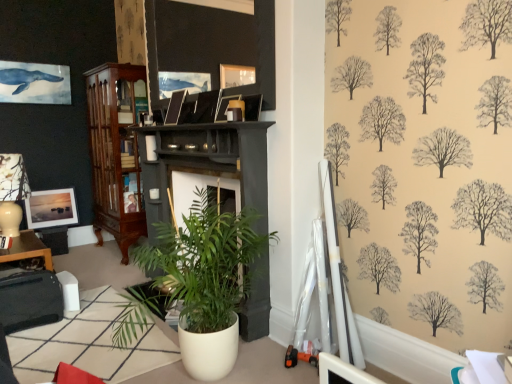
Question: In terms of height, does wooden picture frame at upper center, arranged as the third picture frame when viewed from the back, look taller or shorter compared to mahogany wood cabinet at left?

Choices:
 (A) tall
 (B) short

Answer: (B)

Question: In terms of size, does wooden picture frame at upper center, which appears as the first picture frame when viewed from the front, appear bigger or smaller than mahogany wood cabinet at left?

Choices:
 (A) small
 (B) big

Answer: (A)

Question: Estimate the real-world distances between objects in this image. Which object is closer to the mahogany wood cabinet at left?

Choices:
 (A) matte white picture frame at lower left, the third picture frame from the front
 (B) white glossy table at lower left, which ranks as the 2th table in front-to-back order
 (C) matte brown picture frame at upper center, which appears as the 2th picture frame when viewed from the back
 (D) white glossy table at lower left, which is the second table from back to front
 (E) white glossy pot at center

Answer: (A)

Question: Which is nearer to the white glossy table at lower left, which ranks as the 2th table in front-to-back order?

Choices:
 (A) mahogany wood cabinet at left
 (B) matte black lampshade at left
 (C) white glossy pot at center
 (D) matte white picture frame at lower left, arranged as the 3th picture frame when viewed from the right
 (E) white glossy table at lower left, placed as the 2th table when sorted from left to right

Answer: (D)